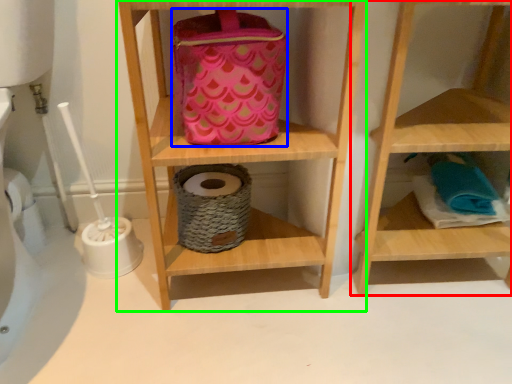
Question: Considering the real-world distances, which object is closest to shelf (highlighted by a red box)? pouch (highlighted by a blue box) or shelf (highlighted by a green box).

Choices:
 (A) pouch
 (B) shelf

Answer: (B)